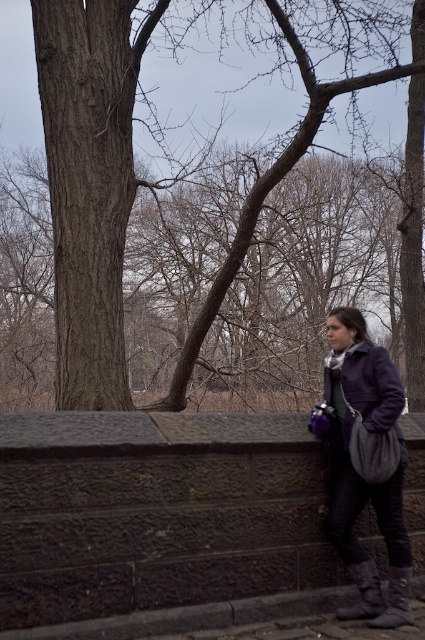
Can you confirm if matte purple coat at right is positioned to the right of matte purple coat at center?

Indeed, matte purple coat at right is positioned on the right side of matte purple coat at center.

Which is below, matte purple coat at right or matte purple coat at center?

matte purple coat at right is lower down.

Image resolution: width=425 pixels, height=640 pixels. Describe the element at coordinates (371, 467) in the screenshot. I see `matte purple coat at right` at that location.

The image size is (425, 640). Find the location of `matte purple coat at right`. matte purple coat at right is located at coordinates (371, 467).

Between brown textured bark at left and matte purple coat at right, which one appears on the right side from the viewer's perspective?

matte purple coat at right is more to the right.

From the picture: Measure the distance from brown textured bark at left to matte purple coat at right.

brown textured bark at left is 2.54 meters from matte purple coat at right.

Which is in front, point (98, 150) or point (328, 355)?

Point (328, 355) is in front.

Identify the location of brown textured bark at left. This screenshot has height=640, width=425. coord(90,184).

Can you confirm if dark stone wall at lower center is bigger than matte purple coat at right?

Correct, dark stone wall at lower center is larger in size than matte purple coat at right.

Can you confirm if dark stone wall at lower center is positioned to the left of matte purple coat at right?

Yes, dark stone wall at lower center is to the left of matte purple coat at right.

The height and width of the screenshot is (640, 425). What do you see at coordinates (156, 513) in the screenshot?
I see `dark stone wall at lower center` at bounding box center [156, 513].

Where is `dark stone wall at lower center`? This screenshot has height=640, width=425. dark stone wall at lower center is located at coordinates (156, 513).